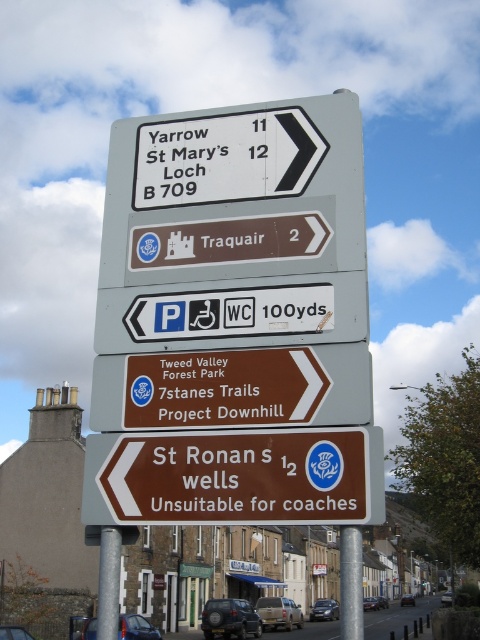
Question: Which of the following is the farthest from the observer?

Choices:
 (A) (331, 481)
 (B) (159, 413)

Answer: (B)

Question: Does brownmaterial/texturesign at center appear over brown matte sign at center?

Choices:
 (A) yes
 (B) no

Answer: (B)

Question: Which of the following is the closest to the observer?

Choices:
 (A) tap(240, 381)
 (B) tap(337, 436)

Answer: (B)

Question: Is brownmaterial/texturesign at center thinner than brown matte sign at center?

Choices:
 (A) yes
 (B) no

Answer: (A)

Question: Can you confirm if brownmaterial/texturesign at center is positioned to the left of brown matte sign at center?

Choices:
 (A) yes
 (B) no

Answer: (B)

Question: Which object appears farthest from the camera in this image?

Choices:
 (A) brownmaterial/texturesign at center
 (B) brown matte sign at center

Answer: (B)